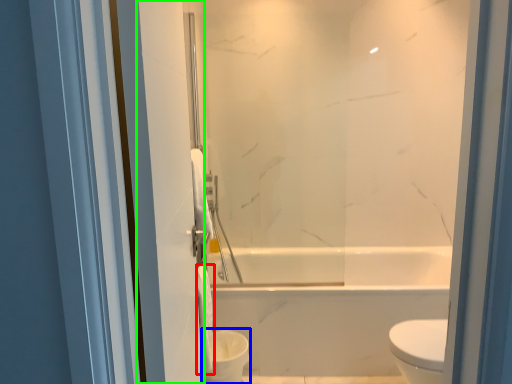
Question: Based on their relative distances, which object is nearer to toilet paper (highlighted by a red box)? Choose from toilet bowl (highlighted by a blue box) and screen door (highlighted by a green box).

Choices:
 (A) toilet bowl
 (B) screen door

Answer: (A)